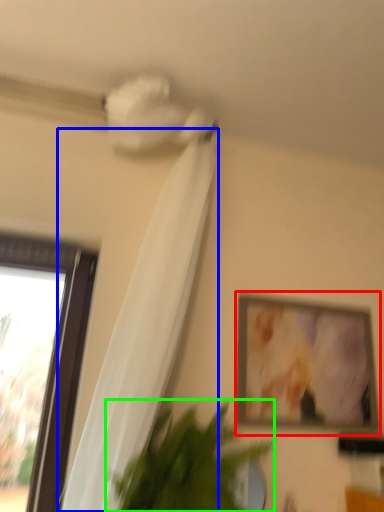
Question: Which object is the farthest from picture frame (highlighted by a red box)? Choose among these: curtain (highlighted by a blue box) or houseplant (highlighted by a green box).

Choices:
 (A) curtain
 (B) houseplant

Answer: (A)